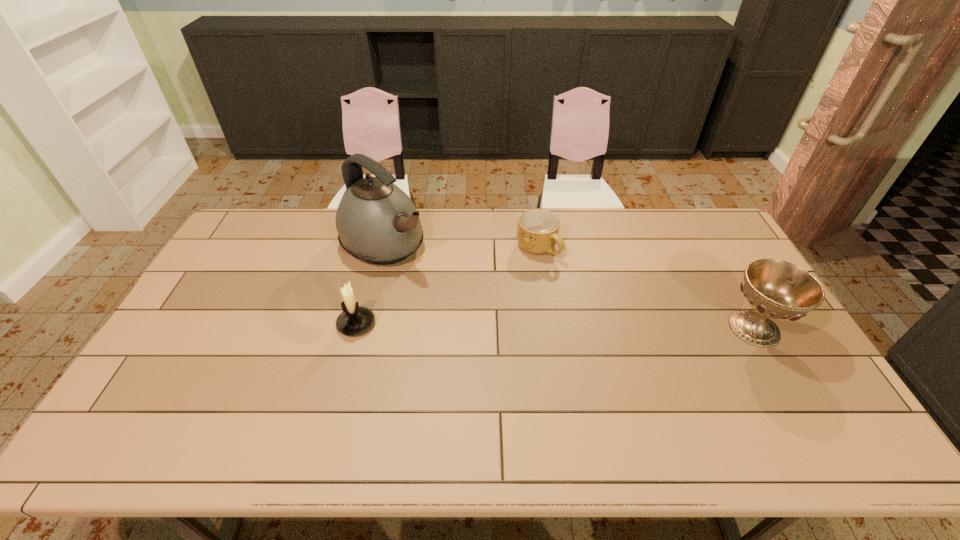
This screenshot has width=960, height=540. In order to click on free location located 0.230m on the side with the handle of the third object from left to right in this screenshot , I will do `click(591, 308)`.

The image size is (960, 540). What are the coordinates of `vacant space located 0.170m on the side with the handle of the third object from left to right` in the screenshot? It's located at (580, 295).

This screenshot has width=960, height=540. I want to click on blank space located 0.390m on the side with the handle of the third object from left to right, so (626, 346).

The width and height of the screenshot is (960, 540). I want to click on kettle at the far edge, so click(377, 222).

Identify the location of mug that is positioned at the far edge. This screenshot has width=960, height=540. (537, 233).

The height and width of the screenshot is (540, 960). Find the location of `object that is positioned at the right edge`. object that is positioned at the right edge is located at coordinates (776, 289).

In the image, there is a desktop. Identify the location of blank space at the far edge. (617, 232).

This screenshot has width=960, height=540. I want to click on vacant space at the near edge of the desktop, so click(x=266, y=408).

The image size is (960, 540). I want to click on free spot at the left edge of the desktop, so click(x=251, y=283).

This screenshot has width=960, height=540. In order to click on vacant space at the right edge of the desktop in this screenshot , I will do `click(777, 359)`.